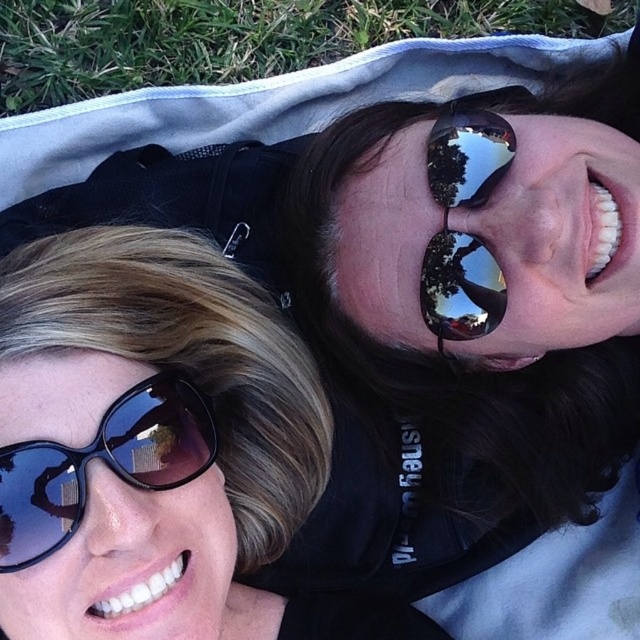
In the scene shown: Who is positioned more to the left, matte black sunglasses at upper left or green grass at upper left?

Positioned to the left is matte black sunglasses at upper left.

Is point (104, 348) less distant than point (6, 51)?

Yes.

Find the location of `matte black sunglasses at upper left`. matte black sunglasses at upper left is located at coordinates (157, 448).

Does green grass at upper left have a larger size compared to matte black sunglasses at lower left?

Yes.

Does green grass at upper left lie in front of matte black sunglasses at lower left?

No.

Where is `green grass at upper left`? The height and width of the screenshot is (640, 640). green grass at upper left is located at coordinates (237, 36).

Does matte black sunglasses at upper left have a larger size compared to shiny reflective sunglasses at center?

Correct, matte black sunglasses at upper left is larger in size than shiny reflective sunglasses at center.

Is point (83, 557) closer to camera compared to point (484, 168)?

Yes, it is.

Locate an element on the screen. matte black sunglasses at upper left is located at coordinates (157, 448).